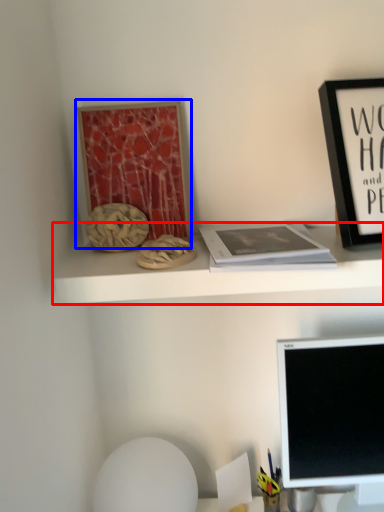
Question: Which object is closer to the camera taking this photo, shelf (highlighted by a red box) or bulletin board (highlighted by a blue box)?

Choices:
 (A) shelf
 (B) bulletin board

Answer: (A)